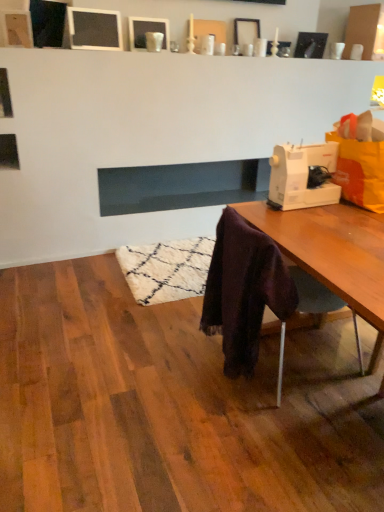
Find the location of `vacant space situated on the left part of velvet purple scarf at lower right`. vacant space situated on the left part of velvet purple scarf at lower right is located at coordinates (173, 366).